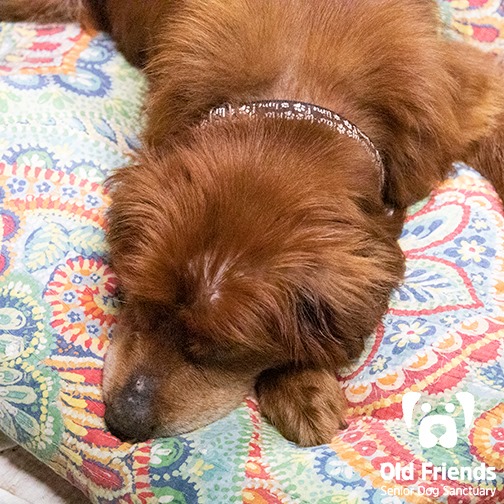
Image resolution: width=504 pixels, height=504 pixels. In order to click on blanket in this screenshot , I will do `click(438, 331)`.